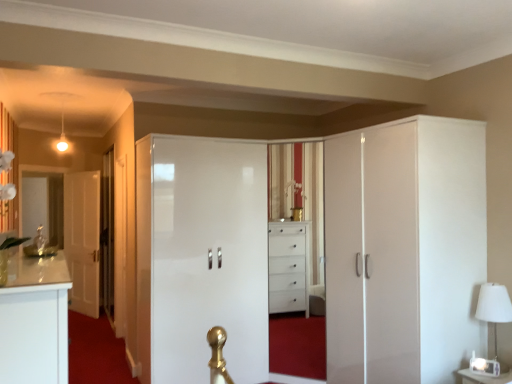
This screenshot has height=384, width=512. What are the coordinates of `glossy white wardrobe at center, which ranks as the first door in front-to-back order` in the screenshot? It's located at (201, 257).

Find the location of a particular element. The image size is (512, 384). transparent glass door at left is located at coordinates (106, 235).

From a real-world perspective, is white glossy dresser at center on top of white fabric lampshade at right?

Yes, from a real-world perspective, white glossy dresser at center is over white fabric lampshade at right

From the image's perspective, which object appears higher, white glossy dresser at center or white fabric lampshade at right?

From the image's view, white glossy dresser at center is above.

Is the position of white glossy dresser at center less distant than that of white fabric lampshade at right?

Yes, the depth of white glossy dresser at center is less than that of white fabric lampshade at right.

Are white glossy dresser at center and white fabric lampshade at right far apart?

white glossy dresser at center is near white fabric lampshade at right, not far away.

Does white glossy door at left, which is the 2th door from front to back, turn towards transparent glass door at left?

No, white glossy door at left, which is the 2th door from front to back, is not aimed at transparent glass door at left.

From the image's perspective, between white glossy door at left, which is the 2th door from front to back, and transparent glass door at left, who is located below?

From the image's view, white glossy door at left, which is the 2th door from front to back, is below.

Looking at this image, from a real-world perspective, who is located higher, white glossy door at left, which is the 1th door from left to right, or transparent glass door at left?

In real-world perspective, transparent glass door at left is above.

Based on the photo, between white glossy door at left, which is the 2th door from front to back, and transparent glass door at left, which one appears on the right side from the viewer's perspective?

Positioned to the right is transparent glass door at left.

Is point (88, 261) closer to camera compared to point (490, 312)?

No, it is behind (490, 312).

Considering their positions, is white glossy door at left, which appears as the 1th door when viewed from the back, located in front of or behind white fabric lampshade at right?

white glossy door at left, which appears as the 1th door when viewed from the back, is positioned farther from the viewer than white fabric lampshade at right.

In order to click on table lamp below the white glossy door at left, which is counted as the 2th door, starting from the right (from the image's perspective) in this screenshot , I will do `click(490, 322)`.

Measure the distance between white glossy door at left, which appears as the 1th door when viewed from the back, and white fabric lampshade at right.

white glossy door at left, which appears as the 1th door when viewed from the back, is 15.28 feet away from white fabric lampshade at right.

Between white glossy dresser at center and glossy white wardrobe at center, which appears as the second door when viewed from the back, which one has larger size?

white glossy dresser at center.

In the image, is white glossy dresser at center on the left side or the right side of glossy white wardrobe at center, acting as the 1th door starting from the right?

white glossy dresser at center is to the right of glossy white wardrobe at center, acting as the 1th door starting from the right.

Consider the image. Are white glossy dresser at center and glossy white wardrobe at center, which ranks as the first door in front-to-back order, making contact?

No, white glossy dresser at center is not touching glossy white wardrobe at center, which ranks as the first door in front-to-back order.

From a real-world perspective, which is physically above, white glossy door at left, which appears as the 1th door when viewed from the back, or white glossy cupboard at right?

In real-world perspective, white glossy cupboard at right is above.

Is white glossy door at left, which is the 1th door from left to right, turned away from white glossy cupboard at right?

white glossy door at left, which is the 1th door from left to right, does not have its back to white glossy cupboard at right.

Is white glossy cupboard at right located within white glossy door at left, which appears as the 1th door when viewed from the back?

Actually, white glossy cupboard at right is outside white glossy door at left, which appears as the 1th door when viewed from the back.

Consider the image. Does white glossy dresser at center come behind white glossy cupboard at right?

No, white glossy dresser at center is in front of white glossy cupboard at right.

Find the location of a particular element. cupboard located behind the white glossy dresser at center is located at coordinates (404, 250).

Can you confirm if white glossy dresser at center is shorter than white glossy cupboard at right?

Yes.

Which is in front, white glossy cupboard at right or glossy white wardrobe at center, which ranks as the first door in front-to-back order?

white glossy cupboard at right is closer to the camera.

Locate an element on the screen. cupboard above the glossy white wardrobe at center, which ranks as the second door in left-to-right order (from the image's perspective) is located at coordinates (404, 250).

Would you say white glossy cupboard at right contains glossy white wardrobe at center, which ranks as the first door in front-to-back order?

No, white glossy cupboard at right does not contain glossy white wardrobe at center, which ranks as the first door in front-to-back order.

From a real-world perspective, is white glossy cupboard at right located beneath glossy white wardrobe at center, which ranks as the first door in front-to-back order?

Incorrect, from a real-world perspective, white glossy cupboard at right is higher than glossy white wardrobe at center, which ranks as the first door in front-to-back order.

Image resolution: width=512 pixels, height=384 pixels. In order to click on dresser lying above the white fabric lampshade at right (from the image's perspective) in this screenshot , I will do `click(405, 250)`.

The width and height of the screenshot is (512, 384). What are the coordinates of `glass door to the right of white glossy door at left, which appears as the 1th door when viewed from the back` in the screenshot? It's located at (106, 235).

In the scene shown: From the image, which object appears to be farther from white glossy door at left, which is the 2th door from front to back, glossy white wardrobe at center, acting as the 1th door starting from the right, or white fabric lampshade at right?

white fabric lampshade at right.

Considering their positions, is white glossy dresser at center positioned closer to white fabric lampshade at right than white glossy cupboard at right?

Among the two, white glossy dresser at center is located nearer to white fabric lampshade at right.

Looking at the image, which one is located further to white glossy cupboard at right, white fabric lampshade at right or transparent glass door at left?

transparent glass door at left is positioned further to the anchor white glossy cupboard at right.

Looking at the image, which one is located further to white fabric lampshade at right, white glossy cupboard at right or transparent glass door at left?

transparent glass door at left is further to white fabric lampshade at right.

When comparing their distances from white glossy door at left, which appears as the 1th door when viewed from the back, does white fabric lampshade at right or glossy white wardrobe at center, which ranks as the first door in front-to-back order, seem further?

white fabric lampshade at right is further to white glossy door at left, which appears as the 1th door when viewed from the back.

Looking at this image, estimate the real-world distances between objects in this image. Which object is closer to glossy white wardrobe at center, acting as the 1th door starting from the right, white glossy cupboard at right or white glossy door at left, which appears as the 1th door when viewed from the back?

white glossy cupboard at right is positioned closer to the anchor glossy white wardrobe at center, acting as the 1th door starting from the right.

Based on their spatial positions, is transparent glass door at left or white fabric lampshade at right further from white glossy door at left, which appears as the 1th door when viewed from the back?

Based on the image, white fabric lampshade at right appears to be further to white glossy door at left, which appears as the 1th door when viewed from the back.

Considering their positions, is white fabric lampshade at right positioned further to white glossy dresser at center than white glossy door at left, which appears as the 1th door when viewed from the back?

Based on the image, white glossy door at left, which appears as the 1th door when viewed from the back, appears to be further to white glossy dresser at center.

Find the location of a particular element. cupboard located between white glossy door at left, which appears as the 1th door when viewed from the back, and white fabric lampshade at right in the left-right direction is located at coordinates (404, 250).

I want to click on door between transparent glass door at left and white glossy cupboard at right in the horizontal direction, so click(201, 257).

Locate an element on the screen. The height and width of the screenshot is (384, 512). table lamp located between white glossy dresser at center and white glossy door at left, which is counted as the 2th door, starting from the right, in the depth direction is located at coordinates (490, 322).

This screenshot has width=512, height=384. I want to click on cupboard between transparent glass door at left and white fabric lampshade at right from left to right, so click(x=404, y=250).